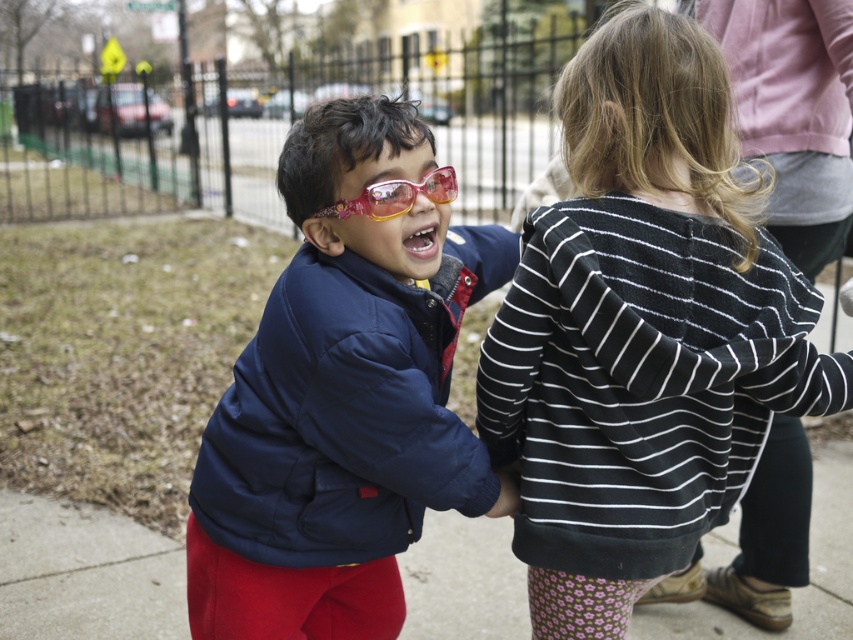
Question: Among these objects, which one is farthest from the camera?

Choices:
 (A) matte blue jacket at center
 (B) pink plastic goggles at center
 (C) concrete at center
 (D) black striped hoodie at center

Answer: (C)

Question: Does concrete at center appear on the right side of pink plastic goggles at center?

Choices:
 (A) yes
 (B) no

Answer: (B)

Question: Is matte blue jacket at center above concrete at center?

Choices:
 (A) no
 (B) yes

Answer: (B)

Question: Which point is closer to the camera?

Choices:
 (A) (378, 189)
 (B) (784, 301)
 (C) (712, 627)

Answer: (A)

Question: Which point is closer to the camera taking this photo?

Choices:
 (A) (344, 269)
 (B) (436, 193)
 (C) (33, 630)

Answer: (B)

Question: Does matte blue jacket at center have a larger size compared to pink plastic goggles at center?

Choices:
 (A) no
 (B) yes

Answer: (B)